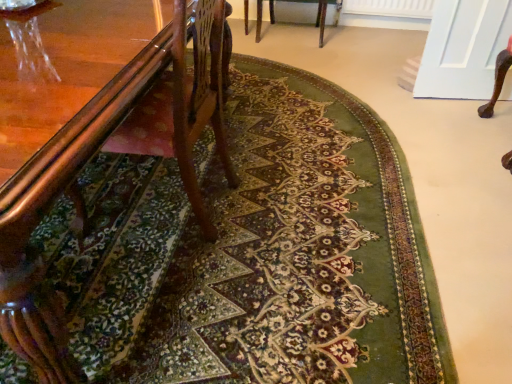
Measure the distance between wooden chair at left, the second chair viewed from the back, and camera.

wooden chair at left, the second chair viewed from the back, is 24.31 inches from camera.

The height and width of the screenshot is (384, 512). What do you see at coordinates (88, 225) in the screenshot?
I see `wooden chair at left, which is counted as the first chair, starting from the front` at bounding box center [88, 225].

The width and height of the screenshot is (512, 384). I want to click on wooden chair at left, the 1th chair when ordered from left to right, so click(x=88, y=225).

The height and width of the screenshot is (384, 512). What are the coordinates of `wooden chair at center, which is the first chair in right-to-left order` in the screenshot? It's located at (317, 13).

This screenshot has height=384, width=512. Describe the element at coordinates (317, 13) in the screenshot. I see `wooden chair at center, acting as the first chair starting from the back` at that location.

The image size is (512, 384). I want to click on wooden chair at left, arranged as the 2th chair when viewed from the right, so point(88,225).

Is wooden chair at left, positioned as the 1th chair in bottom-to-top order, to the left or to the right of wooden chair at center, acting as the first chair starting from the back, in the image?

wooden chair at left, positioned as the 1th chair in bottom-to-top order, is to the left of wooden chair at center, acting as the first chair starting from the back.

Is wooden chair at left, the second chair viewed from the back, in front of wooden chair at center, acting as the first chair starting from the back?

Yes, the depth of wooden chair at left, the second chair viewed from the back, is less than that of wooden chair at center, acting as the first chair starting from the back.

Which is closer, (87, 168) or (244, 20)?

Point (87, 168) appears to be closer to the viewer than point (244, 20).

From the image's perspective, is wooden chair at left, arranged as the 2th chair when viewed from the right, above wooden chair at center, acting as the first chair starting from the back?

No, from the image's perspective, wooden chair at left, arranged as the 2th chair when viewed from the right, is not on top of wooden chair at center, acting as the first chair starting from the back.

From a real-world perspective, is wooden chair at left, arranged as the second chair when viewed from the top, positioned under wooden chair at center, which is the first chair in right-to-left order, based on gravity?

No.

Between wooden chair at left, positioned as the 1th chair in bottom-to-top order, and wooden chair at center, which is the first chair in right-to-left order, which one has smaller width?

With smaller width is wooden chair at center, which is the first chair in right-to-left order.

Is wooden chair at left, positioned as the 1th chair in bottom-to-top order, shorter than wooden chair at center, which is the first chair in right-to-left order?

No, wooden chair at left, positioned as the 1th chair in bottom-to-top order, is not shorter than wooden chair at center, which is the first chair in right-to-left order.

Which of these two, wooden chair at left, the 1th chair when ordered from left to right, or wooden chair at center, which is counted as the 2th chair, starting from the left, is bigger?

Bigger between the two is wooden chair at left, the 1th chair when ordered from left to right.

Would you say wooden chair at left, arranged as the 2th chair when viewed from the right, is inside or outside wooden chair at center, which is counted as the 2th chair, starting from the left?

wooden chair at left, arranged as the 2th chair when viewed from the right, is outside wooden chair at center, which is counted as the 2th chair, starting from the left.

Is wooden chair at left, which is counted as the first chair, starting from the front, far from wooden chair at center, which is counted as the 2th chair, starting from the bottom?

Indeed, wooden chair at left, which is counted as the first chair, starting from the front, is not near wooden chair at center, which is counted as the 2th chair, starting from the bottom.

Is wooden chair at left, arranged as the 2th chair when viewed from the right, looking in the opposite direction of wooden chair at center, which appears as the 1th chair when viewed from the top?

No, wooden chair at center, which appears as the 1th chair when viewed from the top, is not at the back of wooden chair at left, arranged as the 2th chair when viewed from the right.

How different are the orientations of wooden chair at left, the second chair viewed from the back, and wooden chair at center, which is counted as the 2th chair, starting from the left, in degrees?

The facing directions of wooden chair at left, the second chair viewed from the back, and wooden chair at center, which is counted as the 2th chair, starting from the left, are 89.5 degrees apart.

How far apart are wooden chair at left, which is counted as the first chair, starting from the front, and wooden chair at center, which is the first chair in right-to-left order?

They are 2.14 meters apart.

You are a GUI agent. You are given a task and a screenshot of the screen. Output one action in this format:
    pyautogui.click(x=<x>, y=<y>)
    Task: Click on the chair above the wooden chair at center, which is counted as the 2th chair, starting from the bottom (from a real-world perspective)
    The height and width of the screenshot is (384, 512).
    Given the screenshot: What is the action you would take?
    pyautogui.click(x=88, y=225)

Is wooden chair at center, which is the second chair from front to back, at the right side of wooden chair at left, the second chair viewed from the back?

Correct, you'll find wooden chair at center, which is the second chair from front to back, to the right of wooden chair at left, the second chair viewed from the back.

Which object is further away from the camera taking this photo, wooden chair at center, acting as the first chair starting from the back, or wooden chair at left, arranged as the second chair when viewed from the top?

wooden chair at center, acting as the first chair starting from the back, is more distant.

Is point (271, 20) closer or farther from the camera than point (66, 311)?

Point (271, 20) appears to be farther away from the viewer than point (66, 311).

From the image's perspective, is wooden chair at center, which is the second chair from front to back, beneath wooden chair at left, arranged as the 2th chair when viewed from the right?

No.

From a real-world perspective, is wooden chair at center, which is the second chair from front to back, above or below wooden chair at left, arranged as the second chair when viewed from the top?

wooden chair at center, which is the second chair from front to back, is situated lower than wooden chair at left, arranged as the second chair when viewed from the top, in the real world.

In terms of width, does wooden chair at center, which is counted as the 2th chair, starting from the bottom, look wider or thinner when compared to wooden chair at left, arranged as the 2th chair when viewed from the right?

Clearly, wooden chair at center, which is counted as the 2th chair, starting from the bottom, has less width compared to wooden chair at left, arranged as the 2th chair when viewed from the right.

Who is taller, wooden chair at center, which is the second chair from front to back, or wooden chair at left, the second chair viewed from the back?

wooden chair at left, the second chair viewed from the back.

Between wooden chair at center, which is counted as the 2th chair, starting from the left, and wooden chair at left, the second chair viewed from the back, which one has larger size?

With larger size is wooden chair at left, the second chair viewed from the back.

Based on the photo, is wooden chair at left, arranged as the 2th chair when viewed from the right, completely or partially inside wooden chair at center, which is the second chair from front to back?

No, wooden chair at left, arranged as the 2th chair when viewed from the right, is not inside wooden chair at center, which is the second chair from front to back.

From the picture: Are wooden chair at center, which is counted as the 2th chair, starting from the left, and wooden chair at left, arranged as the second chair when viewed from the top, making contact?

wooden chair at center, which is counted as the 2th chair, starting from the left, is not next to wooden chair at left, arranged as the second chair when viewed from the top, and they're not touching.

Consider the image. Could you tell me if wooden chair at center, which is counted as the 2th chair, starting from the bottom, is facing wooden chair at left, arranged as the 2th chair when viewed from the right?

Yes, wooden chair at center, which is counted as the 2th chair, starting from the bottom, faces towards wooden chair at left, arranged as the 2th chair when viewed from the right.

This screenshot has height=384, width=512. I want to click on chair behind the wooden chair at left, positioned as the 1th chair in bottom-to-top order, so click(x=317, y=13).

Where is `chair on the left side of wooden chair at center, which is the second chair from front to back`? chair on the left side of wooden chair at center, which is the second chair from front to back is located at coordinates (88, 225).

Identify the location of chair above the wooden chair at left, positioned as the 1th chair in bottom-to-top order (from the image's perspective). The image size is (512, 384). (317, 13).